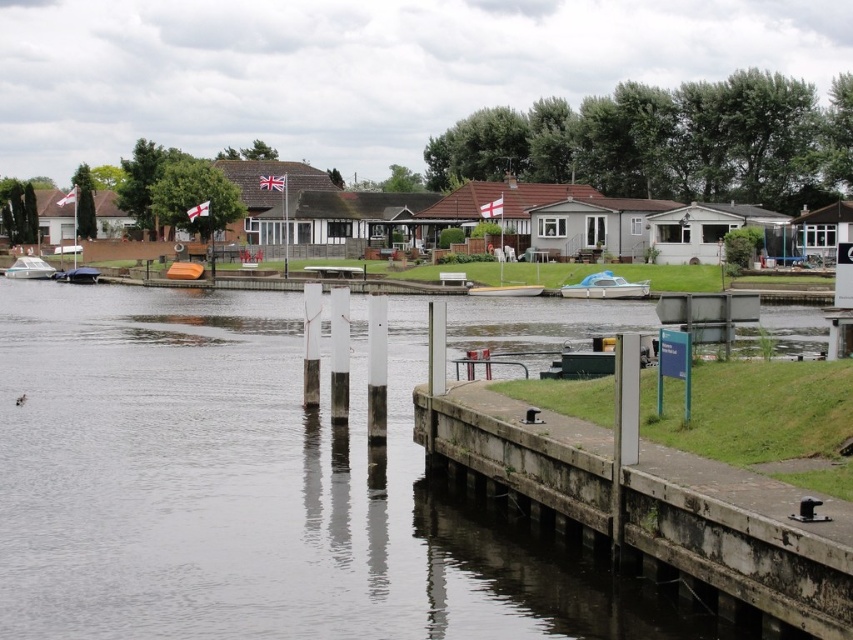
Question: Is smooth concrete water at center to the right of white glossy boat at lower left from the viewer's perspective?

Choices:
 (A) yes
 (B) no

Answer: (A)

Question: Is white glossy boat at lower left smaller than orange matte boat at center?

Choices:
 (A) yes
 (B) no

Answer: (B)

Question: Which object appears farthest from the camera in this image?

Choices:
 (A) smooth concrete water at center
 (B) matte black boat at lower left
 (C) white plastic boat at center
 (D) concrete dock at lower right

Answer: (B)

Question: Which of the following is the farthest from the observer?

Choices:
 (A) matte black boat at lower left
 (B) white glossy boat at lower left

Answer: (B)

Question: Can you confirm if concrete dock at lower right is positioned to the right of white glossy boat at lower left?

Choices:
 (A) no
 (B) yes

Answer: (B)

Question: Which point is farther to the camera?

Choices:
 (A) (280, 449)
 (B) (194, 275)

Answer: (B)